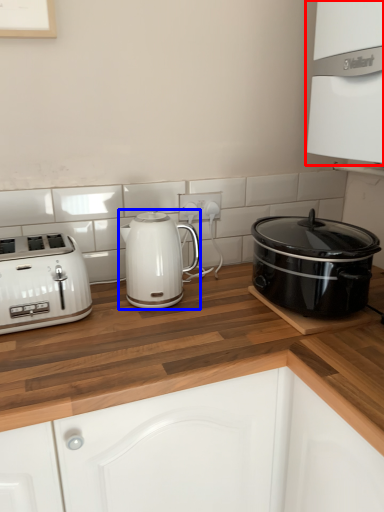
Question: Which object appears closest to the camera in this image, oven (highlighted by a red box) or kettle (highlighted by a blue box)?

Choices:
 (A) oven
 (B) kettle

Answer: (A)